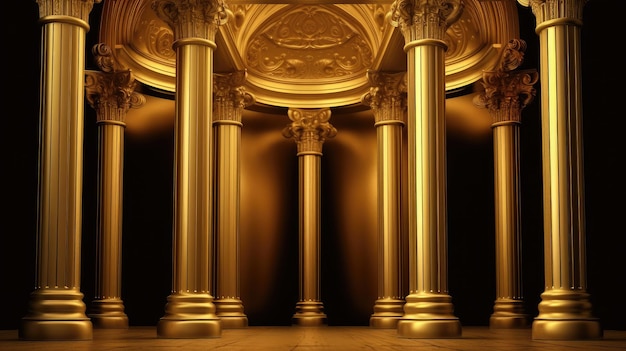
In order to click on base of pillar in this screenshot , I will do `click(68, 317)`, `click(114, 309)`, `click(203, 317)`, `click(239, 315)`, `click(310, 316)`, `click(389, 317)`, `click(501, 314)`, `click(568, 315)`.